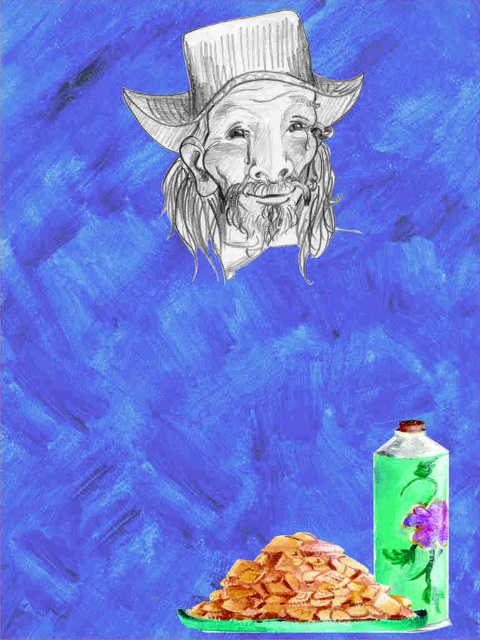
Question: Is the position of green glass bottle at lower right more distant than that of golden crispy chips at lower center?

Choices:
 (A) no
 (B) yes

Answer: (B)

Question: Does graphite pencil cowboy hat at upper center lie behind gray/rough beard at upper center?

Choices:
 (A) no
 (B) yes

Answer: (A)

Question: Among these points, which one is farthest from the camera?

Choices:
 (A) (393, 596)
 (B) (384, 531)
 (C) (292, 202)
 (D) (227, 28)

Answer: (C)

Question: Which object appears farthest from the camera in this image?

Choices:
 (A) graphite pencil cowboy hat at upper center
 (B) golden crispy chips at lower center
 (C) gray/rough beard at upper center

Answer: (C)

Question: Which object is farther from the camera taking this photo?

Choices:
 (A) golden crispy chips at lower center
 (B) gray/rough beard at upper center
 (C) graphite pencil cowboy hat at upper center
 (D) green glass bottle at lower right

Answer: (B)

Question: Can you confirm if graphite pencil cowboy hat at upper center is positioned to the right of green glass bottle at lower right?

Choices:
 (A) no
 (B) yes

Answer: (A)